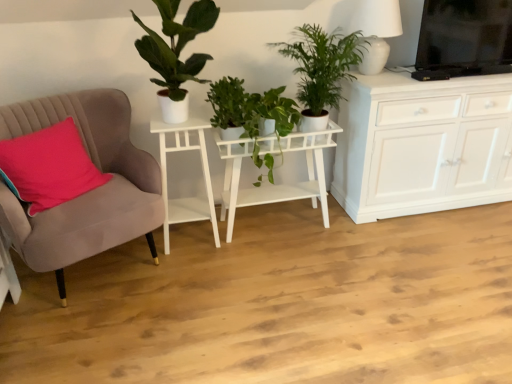
Locate an element on the screen. The width and height of the screenshot is (512, 384). vacant space underneath green leafy plant at upper center, placed as the 3th houseplant when sorted from left to right (from a real-world perspective) is located at coordinates (333, 232).